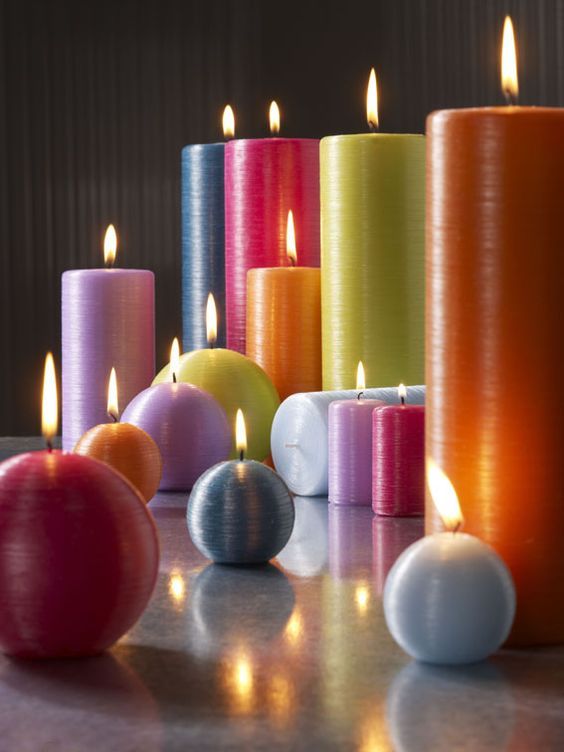
Locate an element on the screen. The image size is (564, 752). round candles is located at coordinates (67, 556), (121, 444), (182, 426), (232, 387), (249, 514), (450, 601).